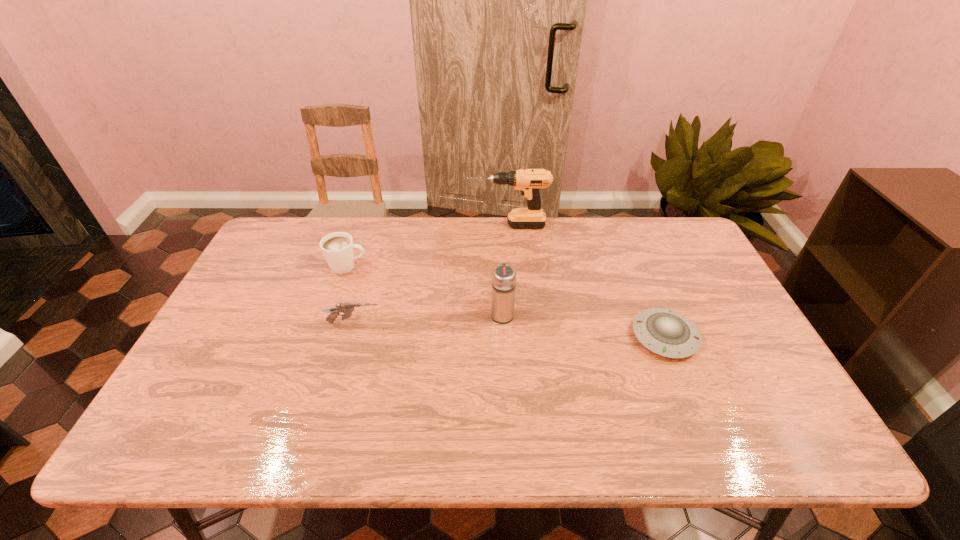
Find the location of `vacant point located 0.230m at the tip of the farthest object`. vacant point located 0.230m at the tip of the farthest object is located at coordinates (402, 226).

Locate an element on the screen. This screenshot has height=540, width=960. vacant space located with a handle on the side of the thermos bottle is located at coordinates (499, 245).

You are a GUI agent. You are given a task and a screenshot of the screen. Output one action in this format:
    pyautogui.click(x=<x>, y=<y>)
    Task: Click on the vacant space located 0.390m with a handle on the side of the thermos bottle
    
    Given the screenshot: What is the action you would take?
    pyautogui.click(x=497, y=224)

Locate an element on the screen. The width and height of the screenshot is (960, 540). vacant space located with a handle on the side of the thermos bottle is located at coordinates (498, 244).

This screenshot has width=960, height=540. I want to click on vacant space located with the handle on the side of the third shortest object, so click(441, 266).

The image size is (960, 540). Find the location of `vacant space located at the barrel of the gun`. vacant space located at the barrel of the gun is located at coordinates (432, 323).

The image size is (960, 540). Identify the location of vacant region located on the front of the shortest object. (702, 429).

Identify the location of drill that is at the far edge. (529, 181).

The width and height of the screenshot is (960, 540). In order to click on cappuccino at the far edge in this screenshot , I will do `click(337, 248)`.

This screenshot has height=540, width=960. I want to click on object located in the right edge section of the desktop, so click(x=665, y=332).